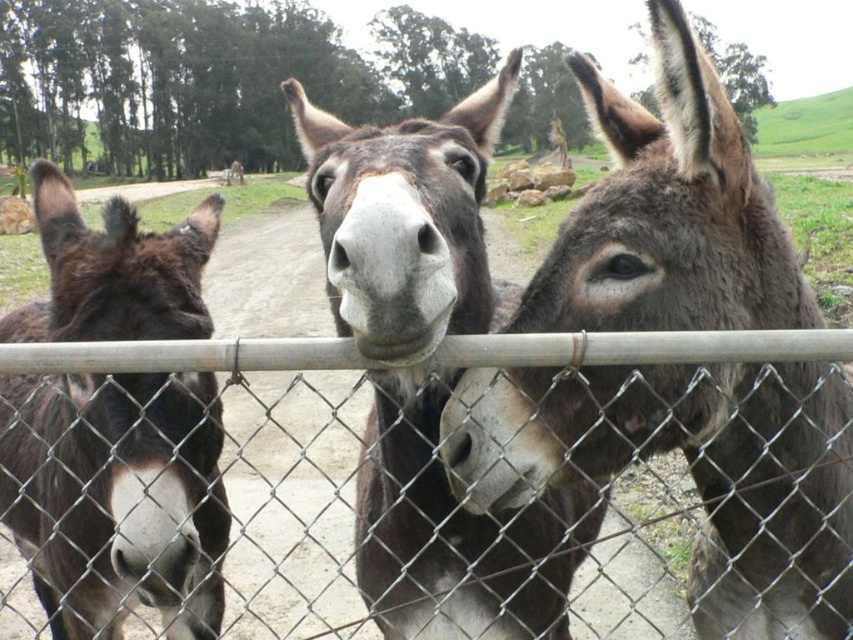
Measure the distance between dark brown fur at center and camera.

They are 1.02 meters apart.

Is dark brown fur at center smaller than metal chain-link fence at center?

Incorrect, dark brown fur at center is not smaller in size than metal chain-link fence at center.

Between point (436, 260) and point (444, 360), which one is positioned in front?

Point (436, 260)

Find the location of a particular element. This screenshot has width=853, height=640. dark brown fur at center is located at coordinates (405, 220).

Who is lower down, gray matte donkey at center or metal chain-link fence at center?

Positioned lower is gray matte donkey at center.

The image size is (853, 640). What do you see at coordinates (689, 472) in the screenshot? I see `gray matte donkey at center` at bounding box center [689, 472].

In order to click on gray matte donkey at center in this screenshot , I will do `click(689, 472)`.

Looking at this image, who is more forward, [724,195] or [552,499]?

Point [724,195] is more forward.

The image size is (853, 640). I want to click on gray matte donkey at center, so pos(689,472).

At what (x,y) coordinates should I click in order to perform the action: click on gray matte donkey at center. Please return your answer as a coordinate pair (x, y). This screenshot has height=640, width=853. Looking at the image, I should click on (689, 472).